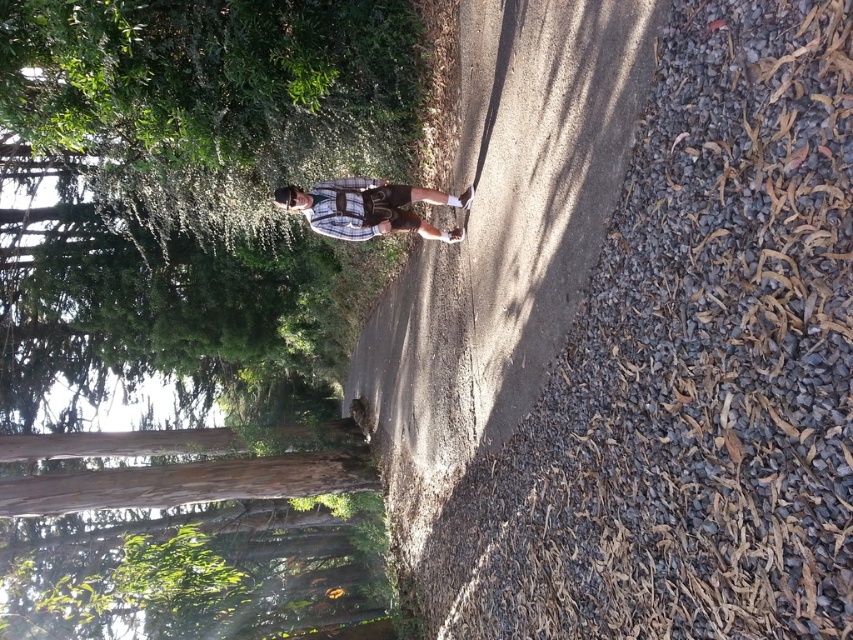
You are standing at the entrance of the forest path and see the green leafy tree at center. If you walk straight ahead, will the tree remain in your line of sight?

The green leafy tree at center is located at point (192, 196), so if you walk straight ahead along the path, the tree will likely remain in your line of sight as it is centrally positioned.

You are a hiker who wants to take a photo of the green leafy tree at center and the plaid fabric shirt at center. If your camera can focus on objects within a 10 feet range, will both subjects be in focus?

The green leafy tree at center is 13.51 feet away from the plaid fabric shirt at center. Since the camera can only focus within 10 feet, the two subjects are too far apart to both be in focus at the same time.